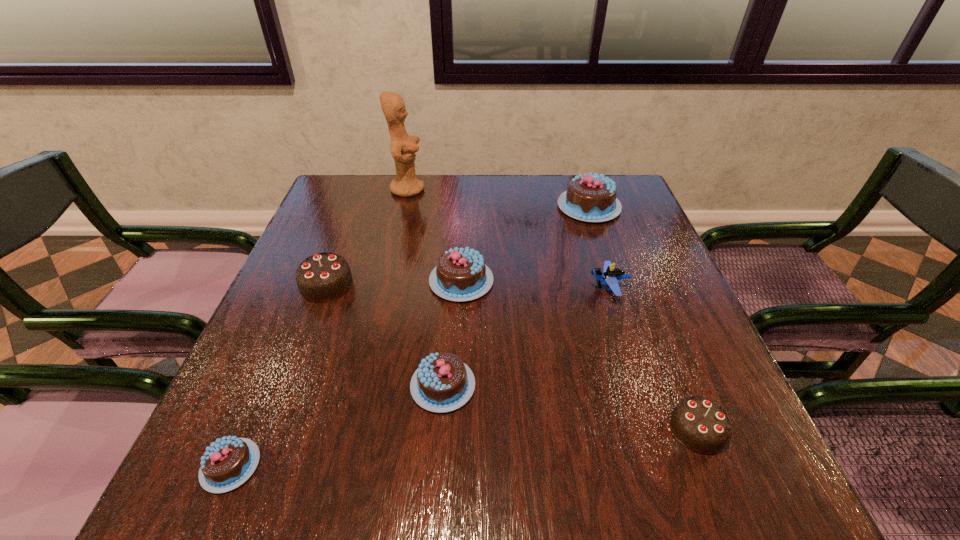
This screenshot has width=960, height=540. In order to click on the tallest object in this screenshot , I will do `click(403, 146)`.

In order to click on the sixth object from right to left in this screenshot , I will do `click(403, 146)`.

Locate an element on the screen. Image resolution: width=960 pixels, height=540 pixels. the biggest pink chocolate cake is located at coordinates (592, 198).

This screenshot has height=540, width=960. In order to click on the farthest chocolate cake in this screenshot , I will do `click(592, 198)`.

This screenshot has width=960, height=540. I want to click on the bigger chocolate chocolate cake, so 323,277.

In order to click on the farther chocolate chocolate cake in this screenshot , I will do `click(323, 277)`.

Locate an element on the screen. This screenshot has width=960, height=540. the third smallest pink chocolate cake is located at coordinates (461, 274).

Identify the location of Lego. (611, 275).

What are the coordinates of `the second nearest pink chocolate cake` in the screenshot? It's located at (442, 383).

The width and height of the screenshot is (960, 540). I want to click on the nearer chocolate chocolate cake, so click(700, 424).